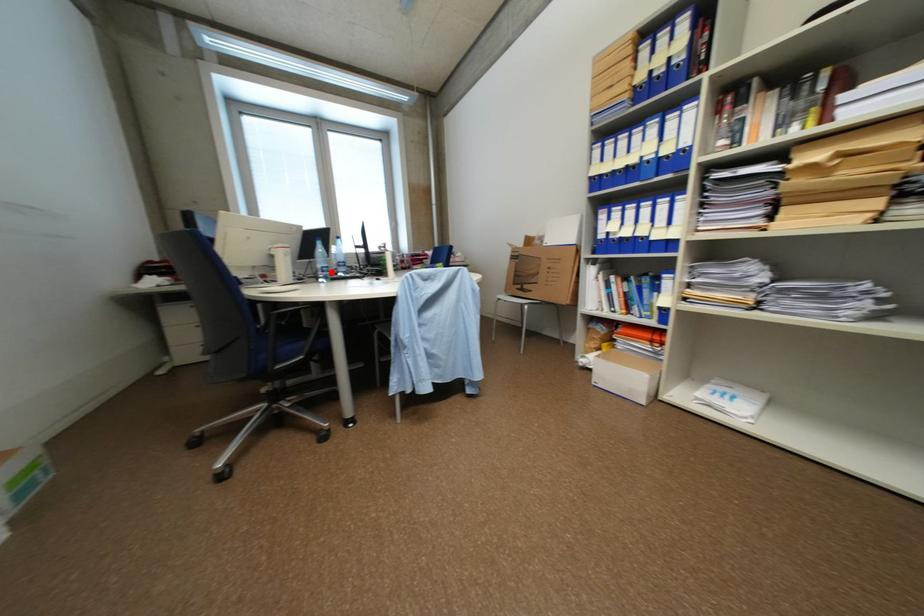
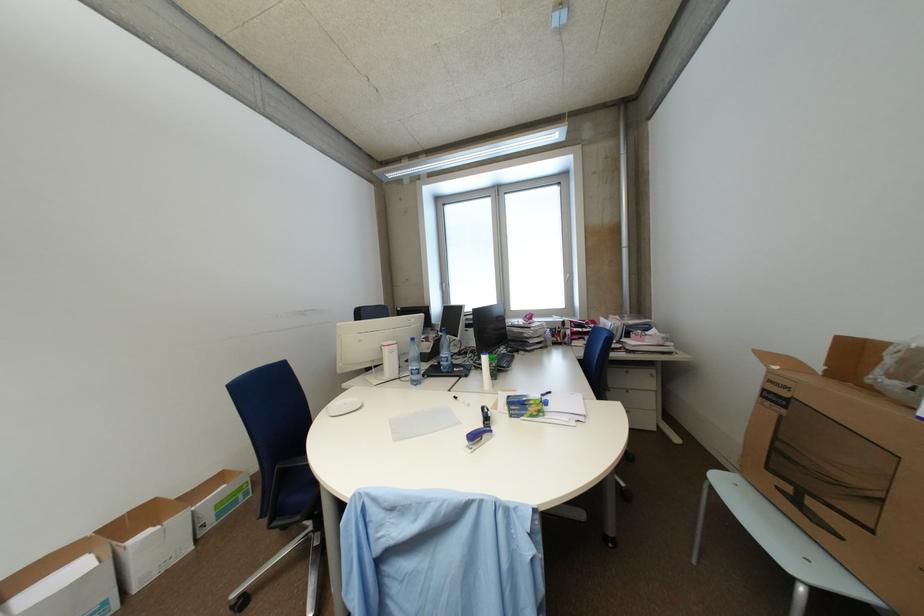
Locate, in the second image, the point that corresponds to the highlighted location in the first image.

(420, 375)